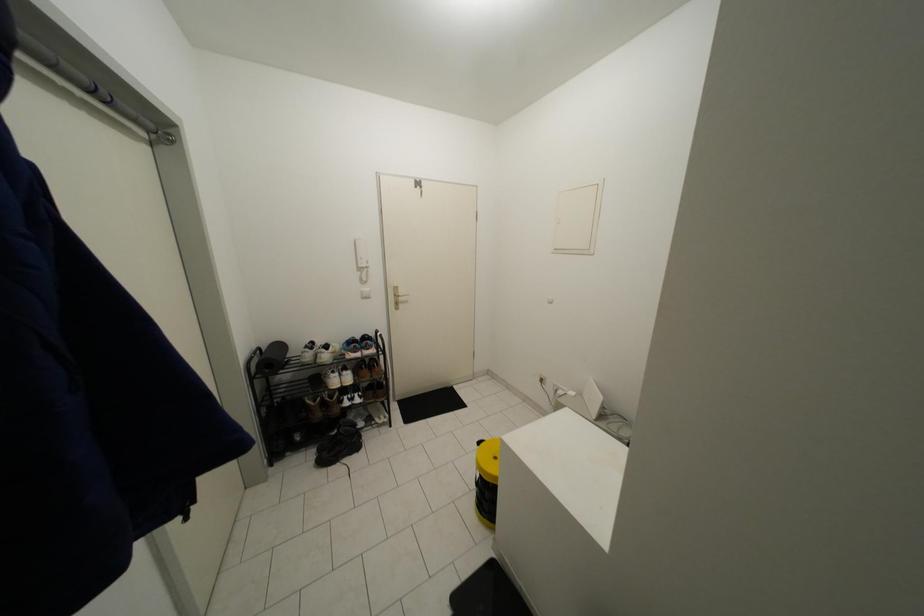
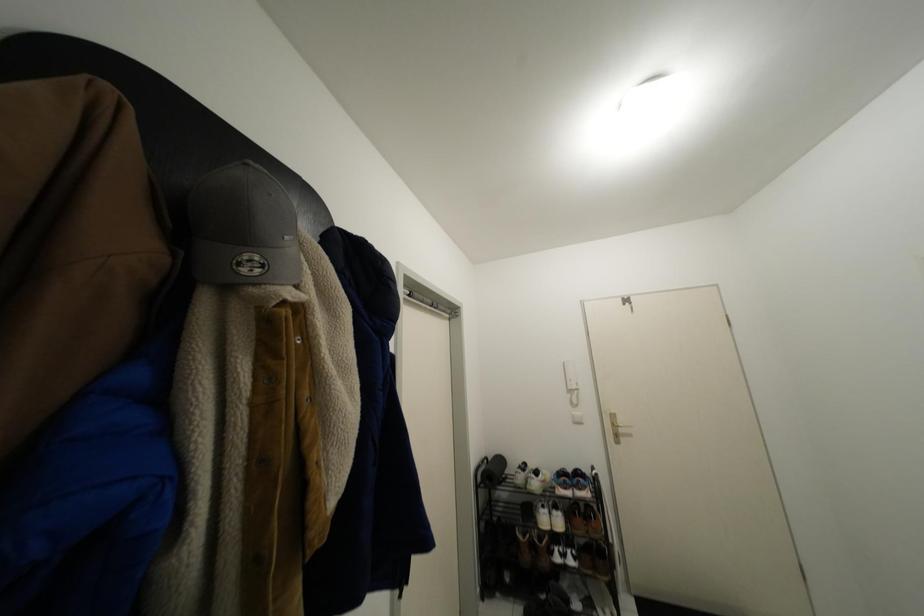
First-person continuous shooting, in which direction is the camera rotating?

The camera's rotation is toward left-up.